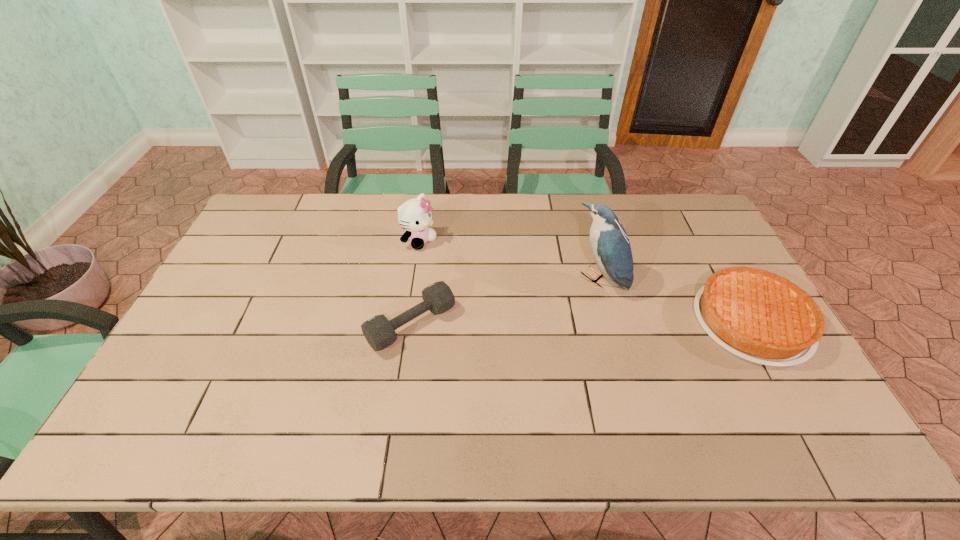
Where is `vacant space at the near left corner of the desktop`? vacant space at the near left corner of the desktop is located at coordinates (202, 381).

Identify the location of empty space that is in between the pie and the tallest object. The height and width of the screenshot is (540, 960). (675, 300).

Identify the location of vacant space that is in between the dumbbell and the farthest object. The width and height of the screenshot is (960, 540). (416, 282).

Image resolution: width=960 pixels, height=540 pixels. I want to click on blank region between the farthest object and the pie, so click(586, 281).

Where is `free space between the dumbbell and the pie`? The height and width of the screenshot is (540, 960). free space between the dumbbell and the pie is located at coordinates (582, 323).

The width and height of the screenshot is (960, 540). Identify the location of vacant region between the bird and the dumbbell. (505, 302).

Where is `vacant point located between the pie and the kitten`? Image resolution: width=960 pixels, height=540 pixels. vacant point located between the pie and the kitten is located at coordinates (586, 281).

You are a GUI agent. You are given a task and a screenshot of the screen. Output one action in this format:
    pyautogui.click(x=<x>, y=<y>)
    Task: Click on the empty space between the pie and the dumbbell
    
    Given the screenshot: What is the action you would take?
    pyautogui.click(x=582, y=323)

This screenshot has height=540, width=960. I want to click on free space that is in between the dumbbell and the second tallest object, so click(x=416, y=282).

You are a GUI agent. You are given a task and a screenshot of the screen. Output one action in this format:
    pyautogui.click(x=<x>, y=<y>)
    Task: Click on the vacant area that lies between the farthest object and the dumbbell
    
    Given the screenshot: What is the action you would take?
    pyautogui.click(x=416, y=282)